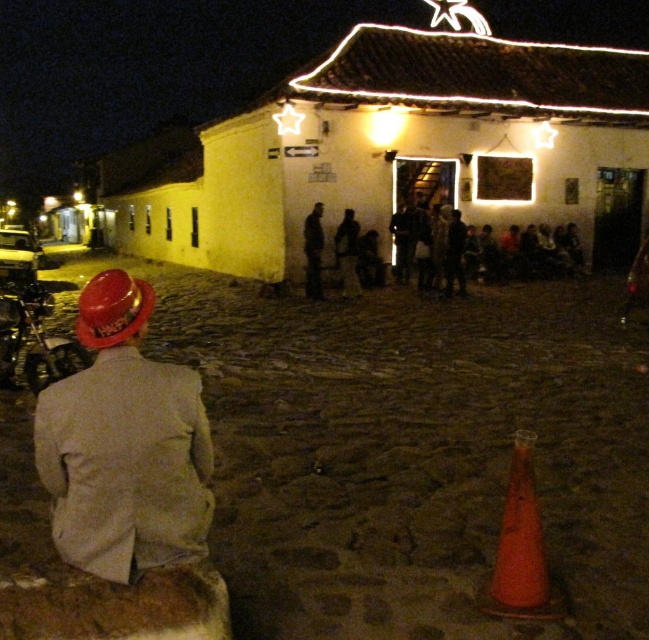
Is orange matte traffic cone at lower right bigger than dark gray fabric at center?

No.

Can you confirm if orange matte traffic cone at lower right is positioned to the left of dark gray fabric at center?

Incorrect, orange matte traffic cone at lower right is not on the left side of dark gray fabric at center.

Is point (509, 508) closer to camera compared to point (317, 264)?

Yes, it is in front of point (317, 264).

Image resolution: width=649 pixels, height=640 pixels. What are the coordinates of `orange matte traffic cone at lower right` in the screenshot? It's located at (520, 547).

Locate an element on the screen. The width and height of the screenshot is (649, 640). matte red hat at lower left is located at coordinates (125, 444).

Between matte red hat at lower left and orange matte traffic cone at lower right, which one is positioned higher?

matte red hat at lower left is above.

Where is `matte red hat at lower left`? The image size is (649, 640). matte red hat at lower left is located at coordinates (125, 444).

Is orange matte traffic cone at lower right taller than shiny chrome motorcycle at lower left?

Yes, orange matte traffic cone at lower right is taller than shiny chrome motorcycle at lower left.

Does orange matte traffic cone at lower right appear under shiny chrome motorcycle at lower left?

Correct, orange matte traffic cone at lower right is located below shiny chrome motorcycle at lower left.

In order to click on orange matte traffic cone at lower right in this screenshot , I will do `click(520, 547)`.